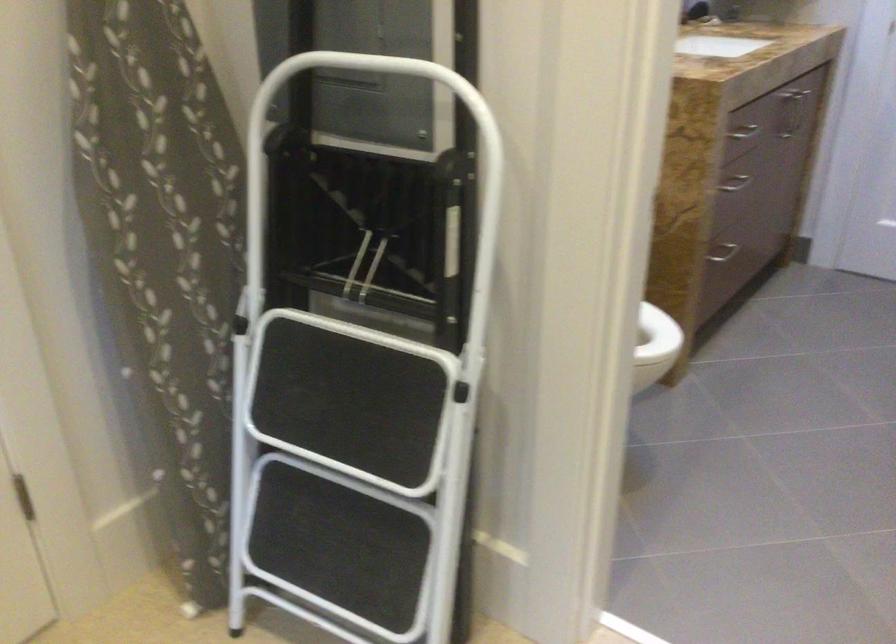
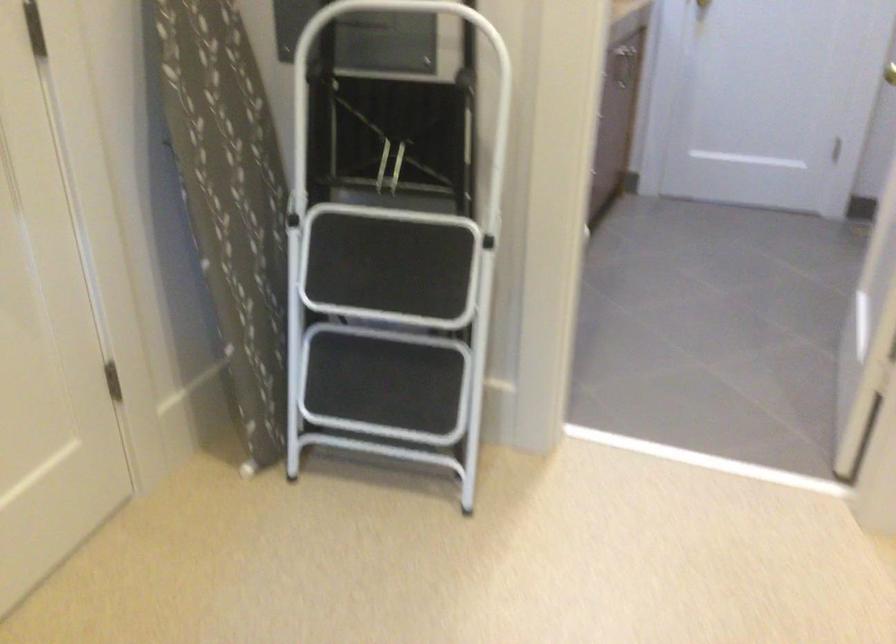
In the second image, find the point that corresponds to the point at 367,73 in the first image.

(378, 13)